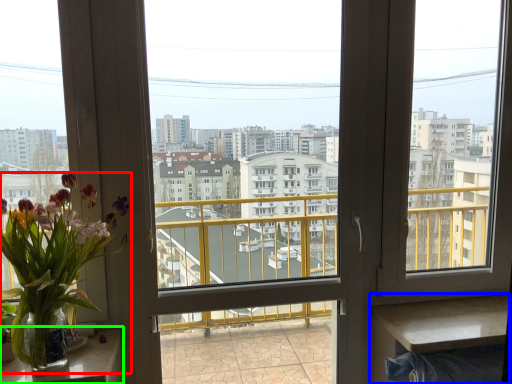
Question: Which is farther away from houseplant (highlighted by a red box)? table (highlighted by a blue box) or table (highlighted by a green box)?

Choices:
 (A) table
 (B) table

Answer: (A)